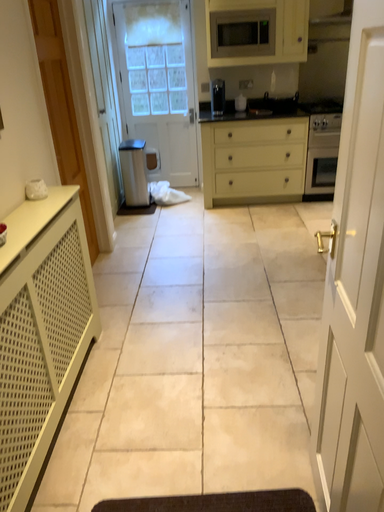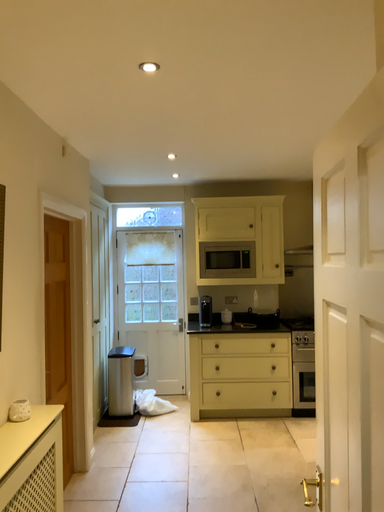
Question: How did the camera likely rotate when shooting the video?

Choices:
 (A) rotated downward
 (B) rotated upward

Answer: (B)